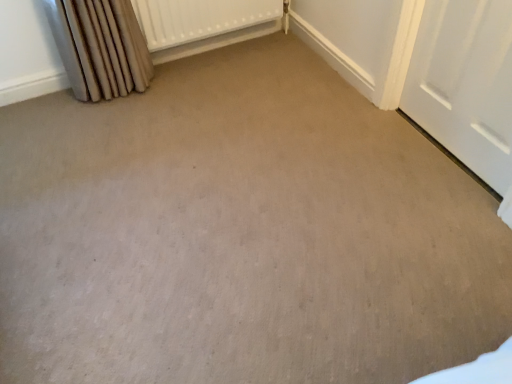
Image resolution: width=512 pixels, height=384 pixels. What are the coordinates of `vacant space underneath white textured radiator at upper center (from a real-world perspective)` in the screenshot? It's located at (211, 48).